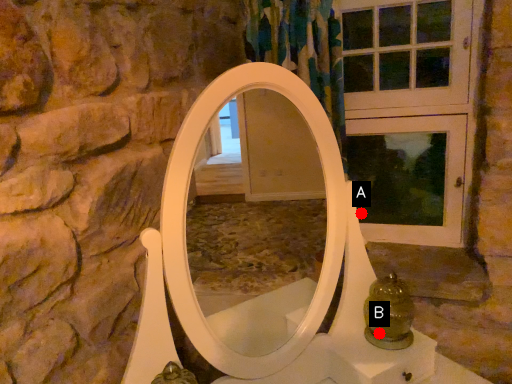
Question: Two points are circled on the image, labeled by A and B beside each circle. Which of the following is the closest to the observer?

Choices:
 (A) A is closer
 (B) B is closer

Answer: (B)